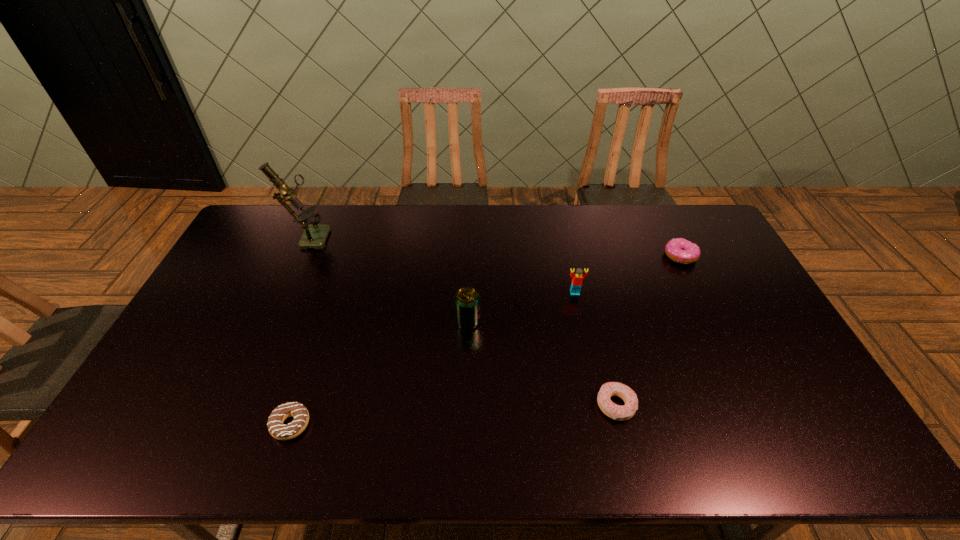
Where is `vacant space in between the third farthest object and the third nearest object`? The width and height of the screenshot is (960, 540). vacant space in between the third farthest object and the third nearest object is located at coordinates (521, 307).

Where is `empty location between the leftmost doughnut and the rightmost object`? The width and height of the screenshot is (960, 540). empty location between the leftmost doughnut and the rightmost object is located at coordinates (486, 340).

The height and width of the screenshot is (540, 960). In order to click on unoccupied position between the leftmost object and the beer can in this screenshot , I will do `click(388, 278)`.

In order to click on vacant space in between the second doughnut from left to right and the beer can in this screenshot , I will do `click(541, 363)`.

At what (x,y) coordinates should I click in order to perform the action: click on the second closest object to the leftmost doughnut. Please return your answer as a coordinate pair (x, y). The width and height of the screenshot is (960, 540). Looking at the image, I should click on (314, 236).

Identify which object is the fifth nearest to the tallest doughnut. Please provide its 2D coordinates. Your answer should be formatted as a tuple, i.e. [(x, y)], where the tuple contains the x and y coordinates of a point satisfying the conditions above.

[(314, 236)]

Locate which doughnut ranks second in proximity to the farthest doughnut. Please provide its 2D coordinates. Your answer should be formatted as a tuple, i.e. [(x, y)], where the tuple contains the x and y coordinates of a point satisfying the conditions above.

[(280, 431)]

Locate an element on the screen. The height and width of the screenshot is (540, 960). doughnut that is the closest to the second doughnut from right to left is located at coordinates (679, 250).

At what (x,y) coordinates should I click in order to perform the action: click on vacant space that satisfies the following two spatial constraints: 1. at the eyepiece of the microscope; 2. on the back side of the second object from left to right. Please return your answer as a coordinate pair (x, y). This screenshot has height=540, width=960. Looking at the image, I should click on (223, 424).

Locate an element on the screen. The width and height of the screenshot is (960, 540). vacant area in the image that satisfies the following two spatial constraints: 1. at the eyepiece of the microscope; 2. on the right side of the second object from left to right is located at coordinates (223, 424).